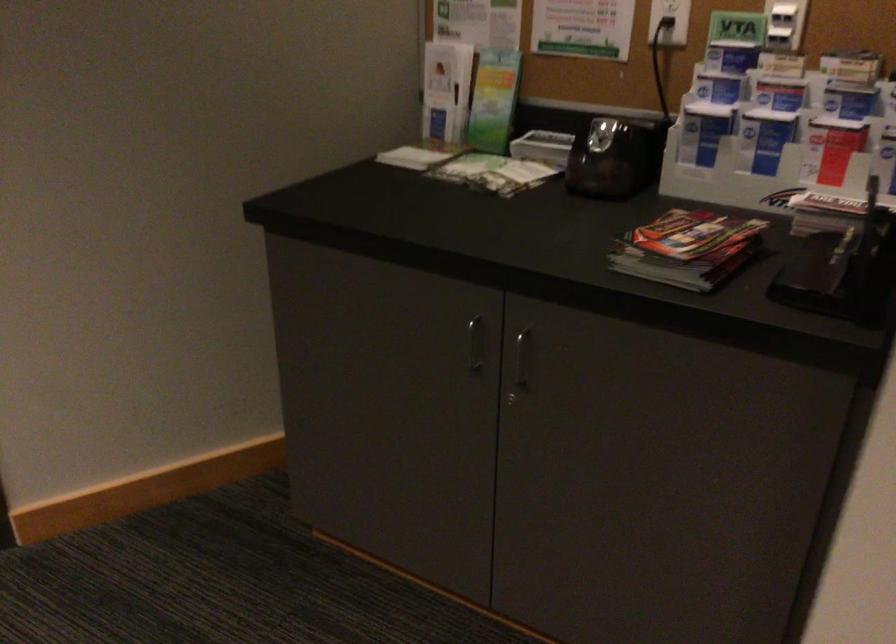
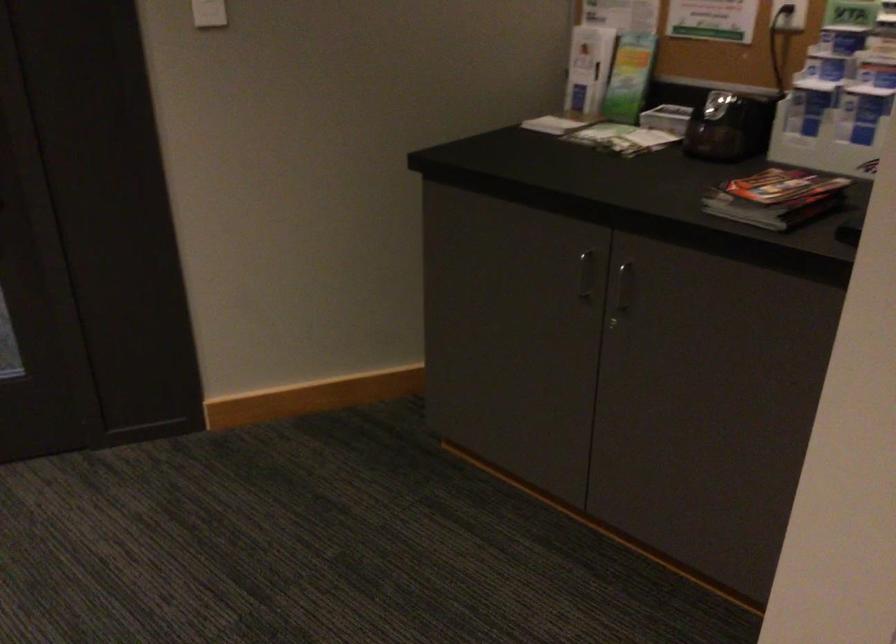
Locate, in the second image, the point that corresponds to point 418,154 in the first image.

(556, 122)